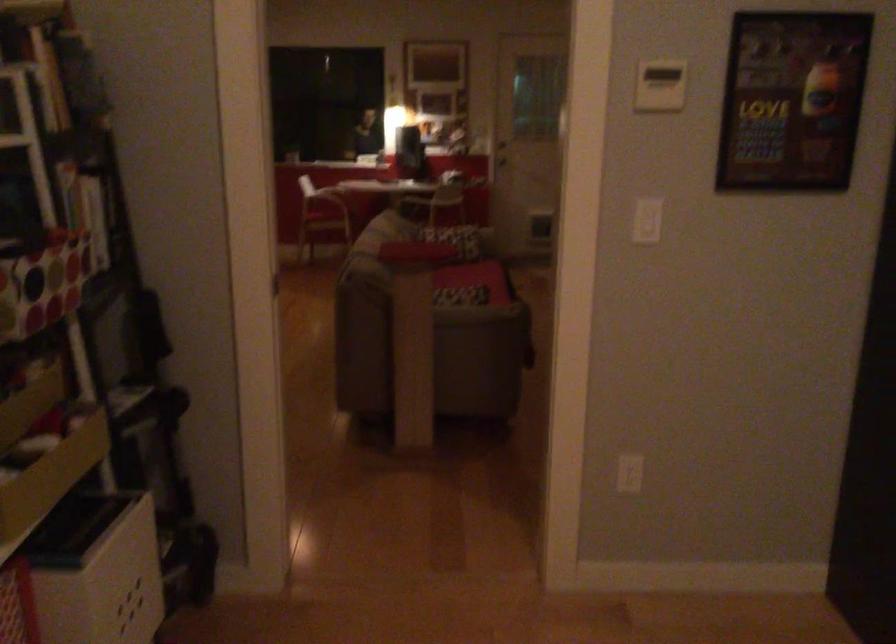
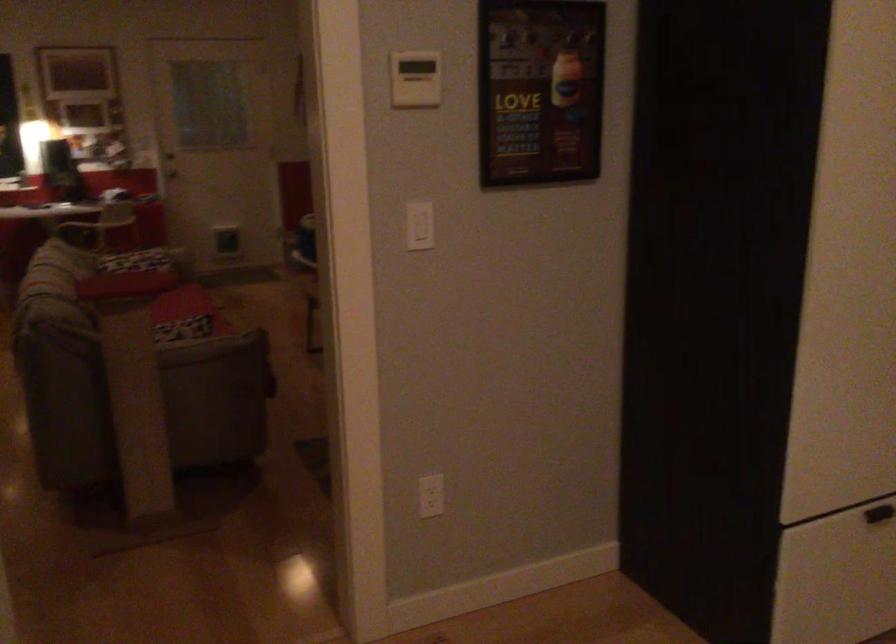
Question: The first image is from the beginning of the video and the second image is from the end. How did the camera likely rotate when shooting the video?

Choices:
 (A) Left
 (B) Right
 (C) Up
 (D) Down

Answer: (B)